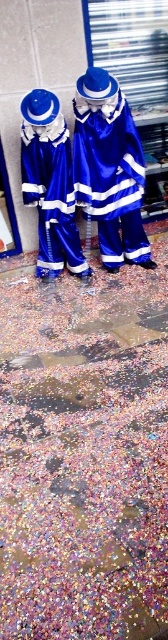
You are a photographer trying to capture a clear shot of the shiny blue costume at center without the confetti at lower center blocking the view. Given the spatial relationship between them, can you position yourself in a way to avoid the confetti?

The confetti at lower center is wider than the shiny blue costume at center, so positioning yourself directly behind or to the side of the costume might allow you to avoid the wider confetti area at lower center and capture a clear shot.

You are a photographer setting up a shoot in the scene described. You need to place a small tripod between the confetti at lower center and the blue satin robe at center. Given the size difference mentioned, which object should the tripod be closer to to ensure stability?

The confetti at lower center has a larger size compared to the blue satin robe at center. Therefore, the tripod should be placed closer to the confetti at lower center to ensure stability, as larger objects provide a more stable base.

You are a photographer trying to capture the shiny blue costume at center without any confetti in the background. Based on the scene described, where should you position yourself relative to the confetti at lower center?

You should position yourself to the right of the confetti at lower center since it is to the left of the shiny blue costume at center, so moving right would place the confetti out of the background.